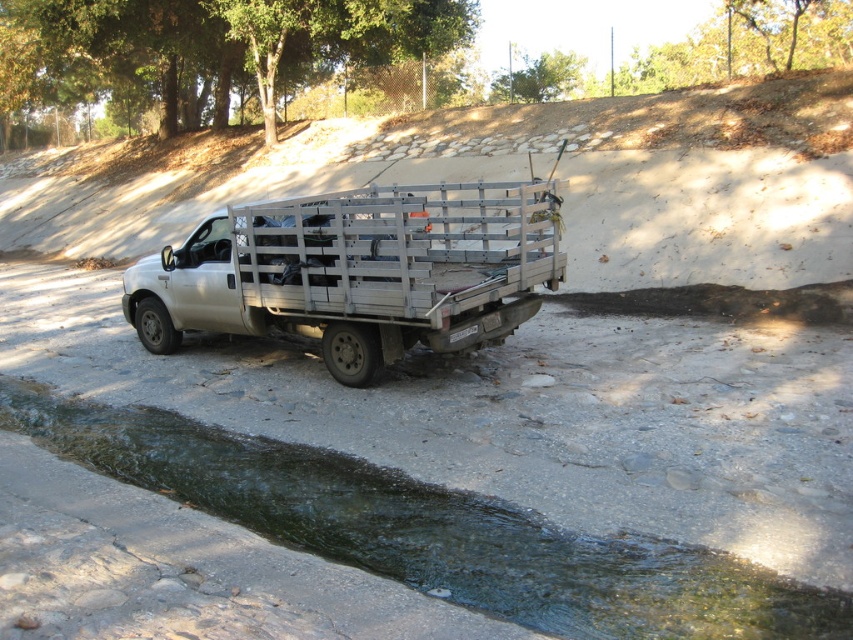
Question: Which of the following is the closest to the observer?

Choices:
 (A) clear water at bottom left
 (B) white metallic truck at center

Answer: (A)

Question: From the image, what is the correct spatial relationship of clear water at bottom left in relation to white metallic truck at center?

Choices:
 (A) right
 (B) left

Answer: (A)

Question: Is clear water at bottom left thinner than white metallic truck at center?

Choices:
 (A) no
 (B) yes

Answer: (A)

Question: Is clear water at bottom left wider than white metallic truck at center?

Choices:
 (A) yes
 (B) no

Answer: (A)